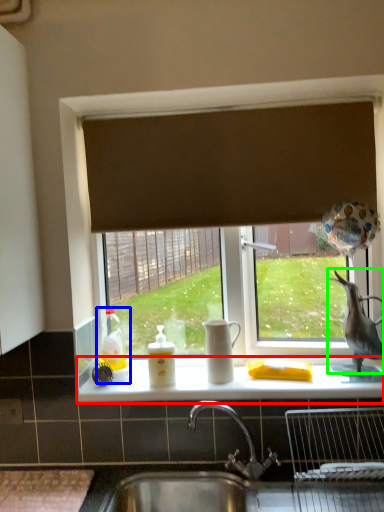
Question: Based on their relative distances, which object is farther from counter top (highlighted by a red box)? Choose from toy (highlighted by a blue box) and animal (highlighted by a green box).

Choices:
 (A) toy
 (B) animal

Answer: (B)